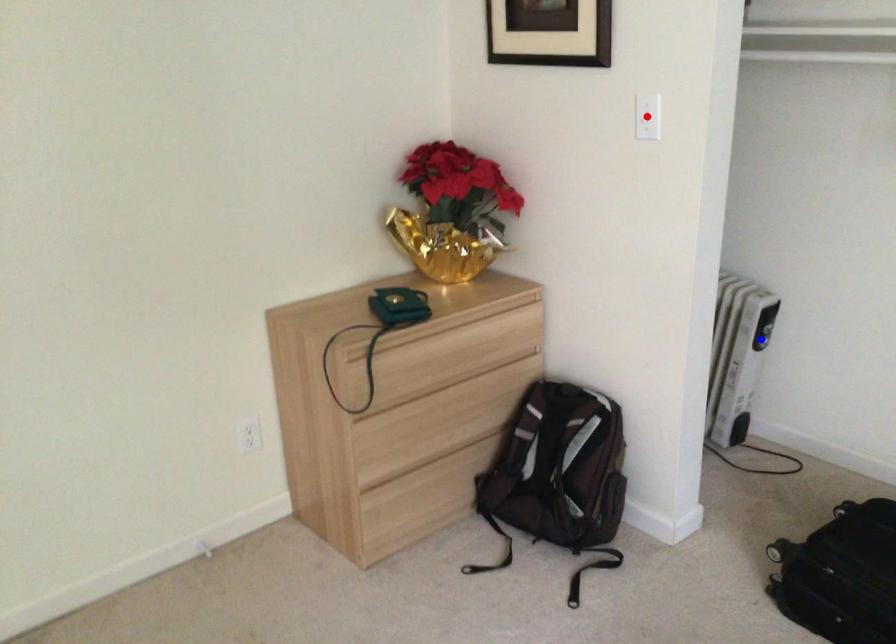
Question: Which of the two points in the image is closer to the camera?

Choices:
 (A) Blue point is closer.
 (B) Red point is closer.

Answer: (B)